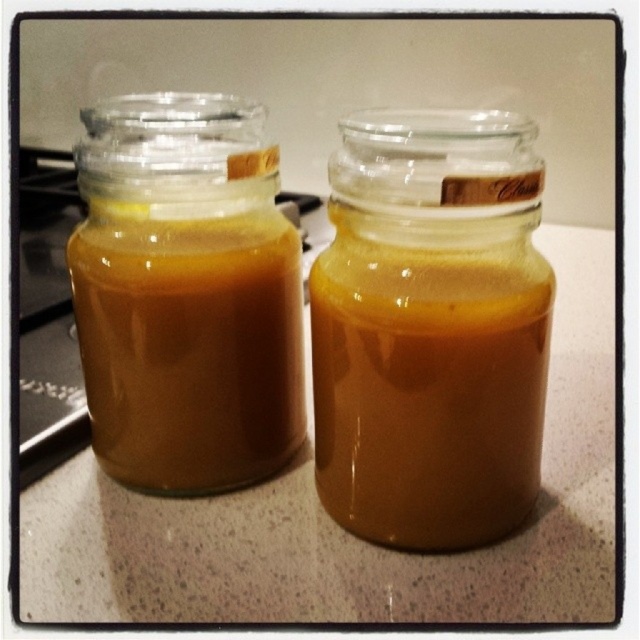
Question: Which of the following is the farthest from the observer?

Choices:
 (A) (532, 448)
 (B) (157, 292)

Answer: (A)

Question: Does golden translucent liquid at center have a lesser width compared to golden translucent jar at left?

Choices:
 (A) no
 (B) yes

Answer: (B)

Question: Which point is closer to the camera?

Choices:
 (A) golden translucent jar at left
 (B) golden translucent liquid at center

Answer: (B)

Question: Can you confirm if golden translucent liquid at center is positioned below golden translucent jar at left?

Choices:
 (A) no
 (B) yes

Answer: (B)

Question: Is golden translucent liquid at center closer to the viewer compared to golden translucent jar at left?

Choices:
 (A) yes
 (B) no

Answer: (A)